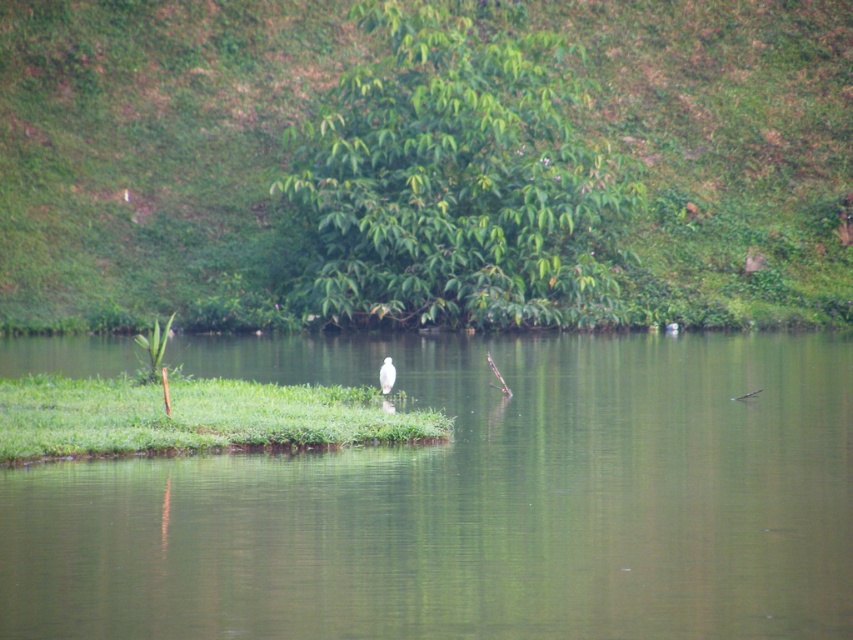
In order to click on green leafy tree at upper center in this screenshot , I will do click(x=457, y=182).

Which is in front, point (431, 244) or point (386, 358)?

Point (386, 358) is more forward.

Who is more forward, (360,305) or (387,371)?

Point (387,371) is in front.

Locate an element on the screen. The image size is (853, 640). green leafy tree at upper center is located at coordinates (457, 182).

Between point (113, 580) and point (374, 150), which one is positioned in front?

Point (113, 580) is more forward.

Describe the element at coordinates (473, 500) in the screenshot. I see `green smooth water at center` at that location.

The image size is (853, 640). Describe the element at coordinates (473, 500) in the screenshot. I see `green smooth water at center` at that location.

Where is `green smooth water at center`? green smooth water at center is located at coordinates (473, 500).

Is point (764, 420) farther from viewer compared to point (219, 378)?

No, it is in front of (219, 378).

Which of these two, green smooth water at center or green grass at center, stands shorter?

A: green grass at center

The width and height of the screenshot is (853, 640). What do you see at coordinates (473, 500) in the screenshot?
I see `green smooth water at center` at bounding box center [473, 500].

Locate an element on the screen. Image resolution: width=853 pixels, height=640 pixels. green smooth water at center is located at coordinates (473, 500).